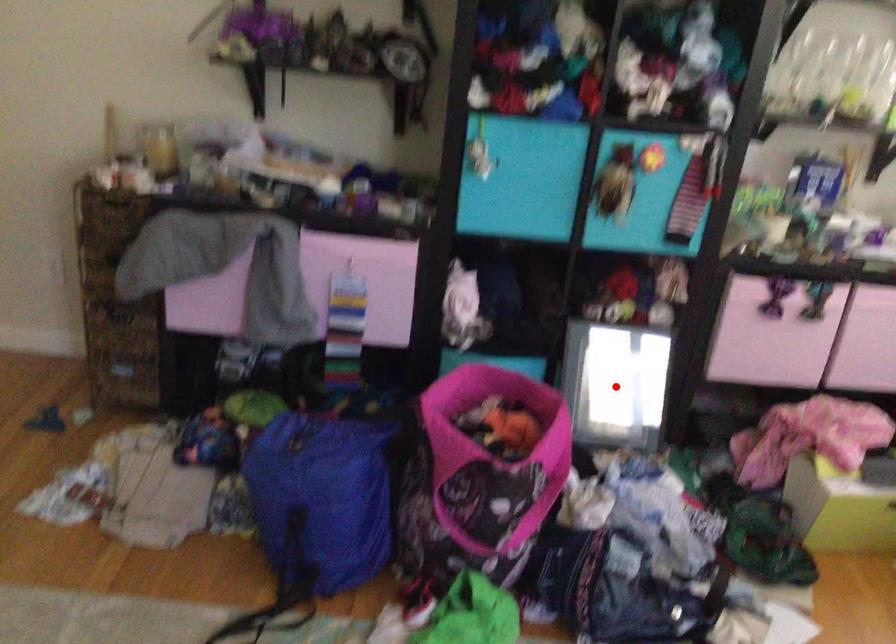
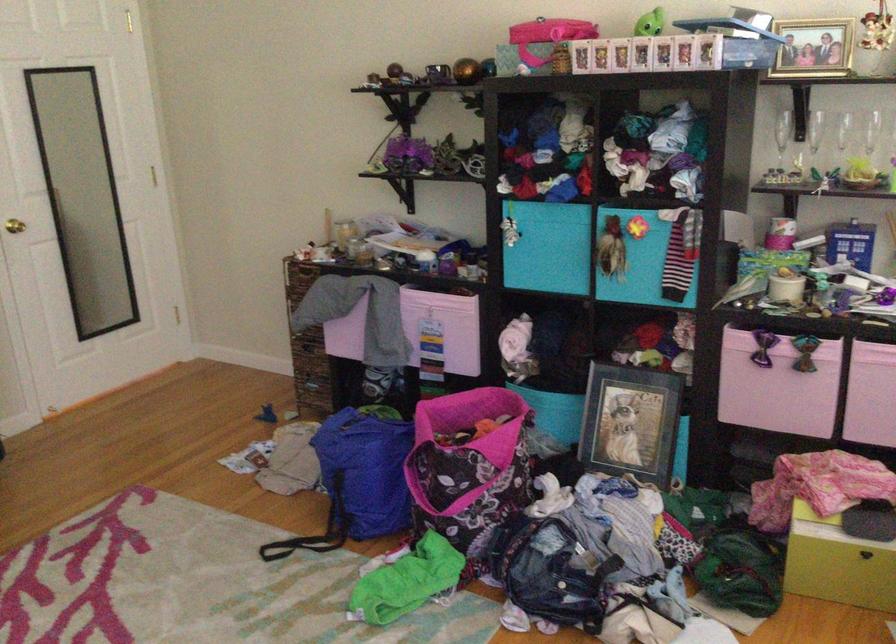
Question: I am providing you with two images of the same scene from different viewpoints. A red point is shown in image1. For the corresponding object point in image2, is it positioned nearer or farther from the camera?

Choices:
 (A) Nearer
 (B) Farther

Answer: (B)